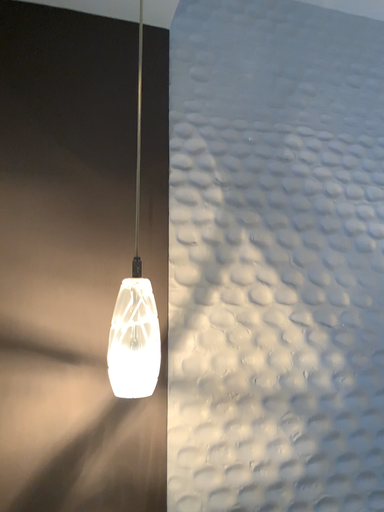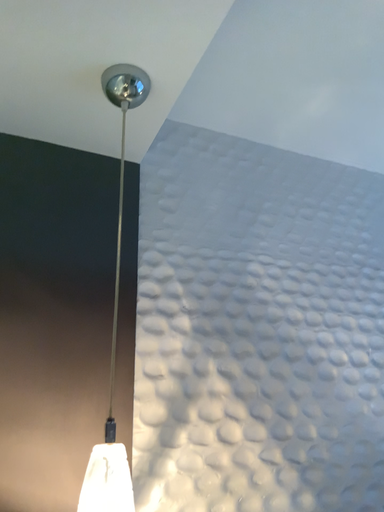
Question: Which way did the camera rotate in the video?

Choices:
 (A) rotated upward
 (B) rotated downward

Answer: (A)